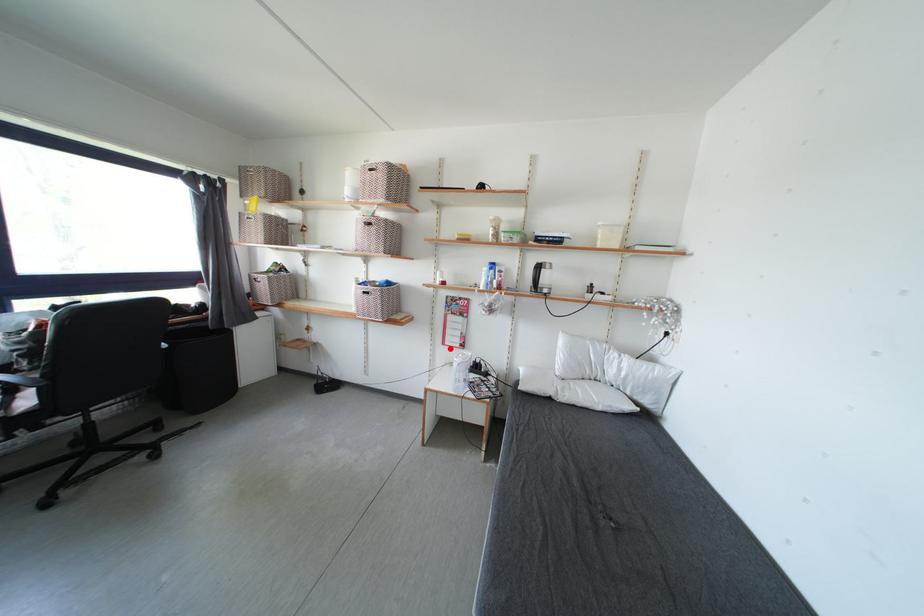
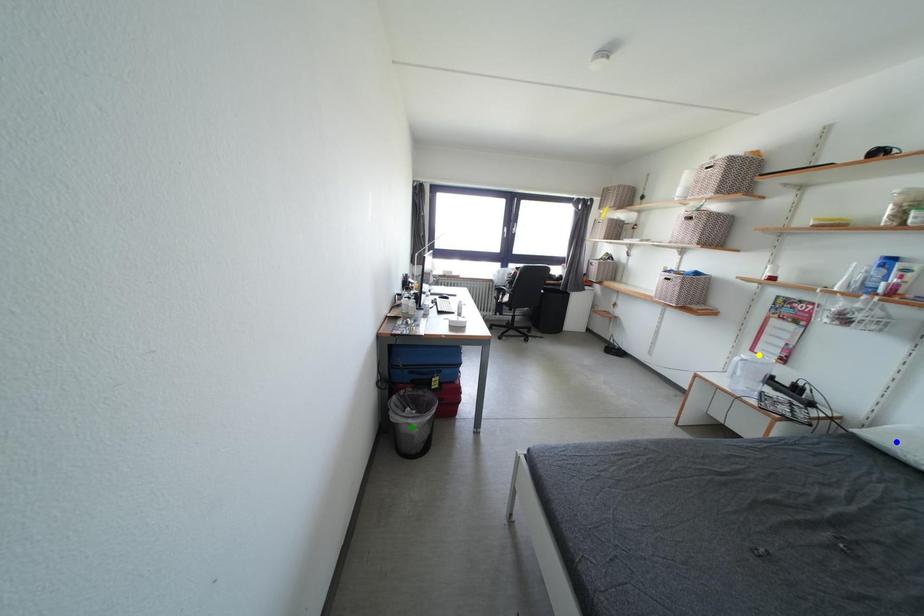
Question: I am providing you with two images of the same scene from different viewpoints. A red point is marked on the first image. You are given multiple points on the second image. Which point in image 2 is actually the same real-world point as the red point in image 1?

Choices:
 (A) yellow point
 (B) green point
 (C) blue point

Answer: (A)